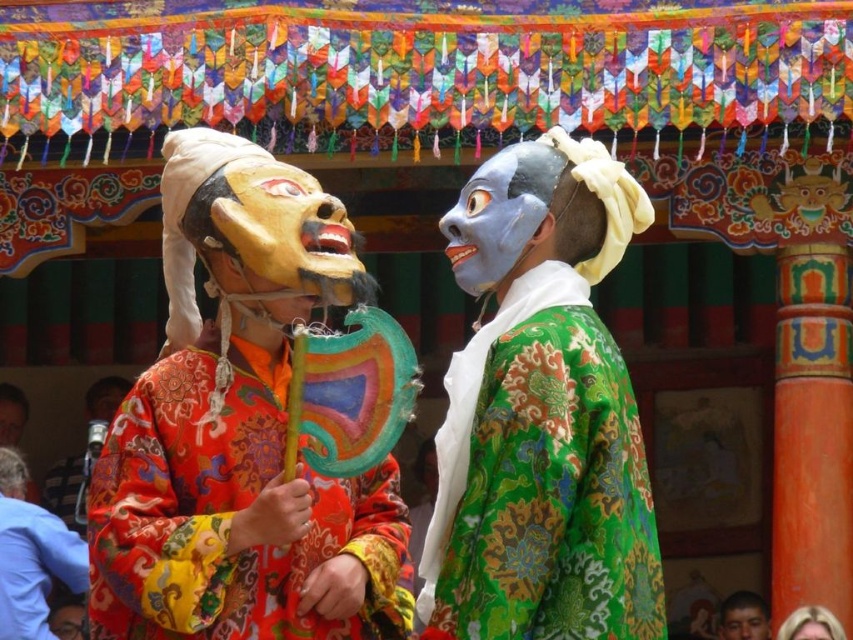
Is shiny silk robe at center shorter than matte blue mask at center?

Incorrect, shiny silk robe at center's height does not fall short of matte blue mask at center's.

Between point (405, 609) and point (511, 204), which one is positioned in front?

Point (405, 609) is more forward.

Locate an element on the screen. The width and height of the screenshot is (853, 640). shiny silk robe at center is located at coordinates (235, 516).

Consider the image. Is matte orange robe at center taller than matte orange costume at left?

No.

Can you confirm if matte orange robe at center is wider than matte orange costume at left?

Indeed, matte orange robe at center has a greater width compared to matte orange costume at left.

Who is more distant from viewer, (x=59, y=544) or (x=51, y=497)?

Point (x=51, y=497)

Where is `matte orange robe at center`? matte orange robe at center is located at coordinates (32, 556).

Is matte yellow mask at center taller than matte orange costume at left?

No.

Does point (244, 234) come in front of point (102, 378)?

Yes, it is.

You are a GUI agent. You are given a task and a screenshot of the screen. Output one action in this format:
    pyautogui.click(x=<x>, y=<y>)
    Task: Click on the matte yellow mask at center
    This screenshot has width=853, height=640.
    Given the screenshot: What is the action you would take?
    pyautogui.click(x=288, y=230)